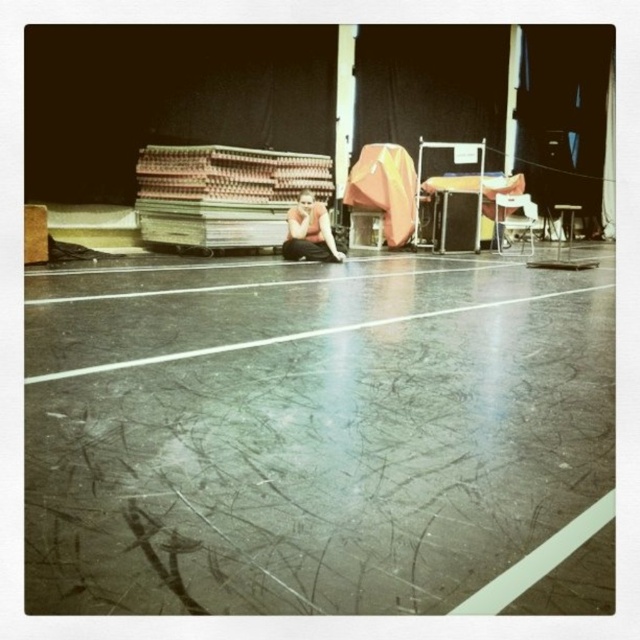
How distant is wooden planks at center from metallic silver chair at center-right?

wooden planks at center is 4.13 meters from metallic silver chair at center-right.

Can you confirm if wooden planks at center is positioned above metallic silver chair at center-right?

Yes, wooden planks at center is above metallic silver chair at center-right.

Is point (268, 177) in front of point (502, 220)?

Yes, point (268, 177) is closer to viewer.

Where is `wooden planks at center`? Image resolution: width=640 pixels, height=640 pixels. wooden planks at center is located at coordinates (221, 195).

Is matte black squat at center to the left of metallic silver chair at center-right from the viewer's perspective?

Yes, matte black squat at center is to the left of metallic silver chair at center-right.

Is point (294, 204) positioned after point (499, 240)?

No, it is in front of (499, 240).

Locate an element on the screen. matte black squat at center is located at coordinates (308, 232).

Based on the photo, does wooden planks at center appear under matte black squat at center?

Incorrect, wooden planks at center is not positioned below matte black squat at center.

Image resolution: width=640 pixels, height=640 pixels. Describe the element at coordinates (221, 195) in the screenshot. I see `wooden planks at center` at that location.

Where is `wooden planks at center`? The width and height of the screenshot is (640, 640). wooden planks at center is located at coordinates (221, 195).